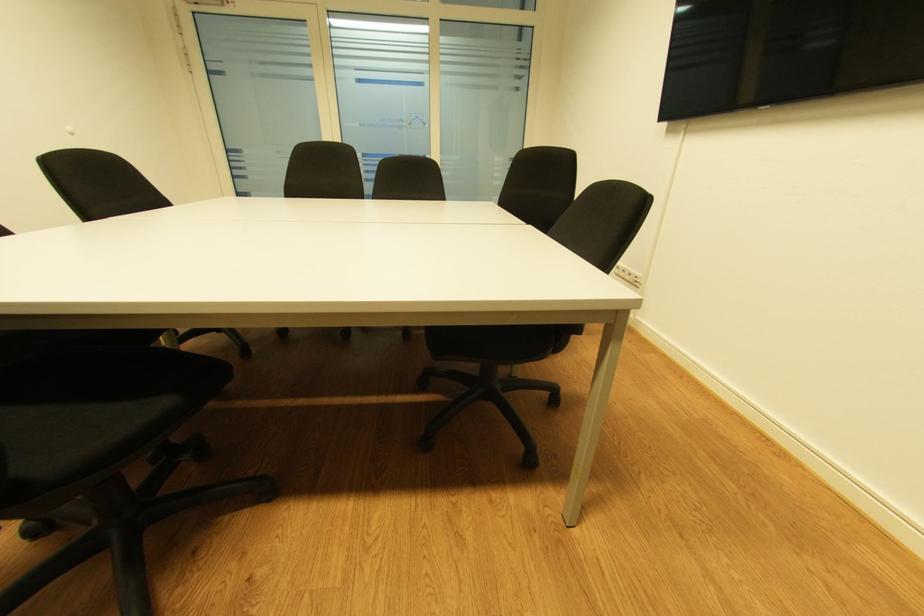
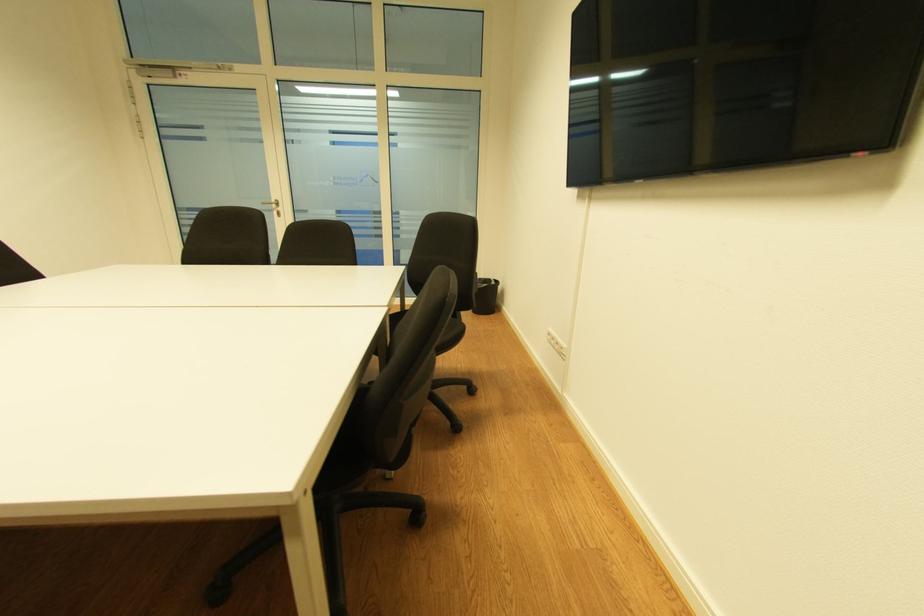
Question: Based on the continuous images, in which direction is the camera rotating? Reply with the corresponding letter.

Choices:
 (A) Left
 (B) Right
 (C) Up
 (D) Down

Answer: (C)